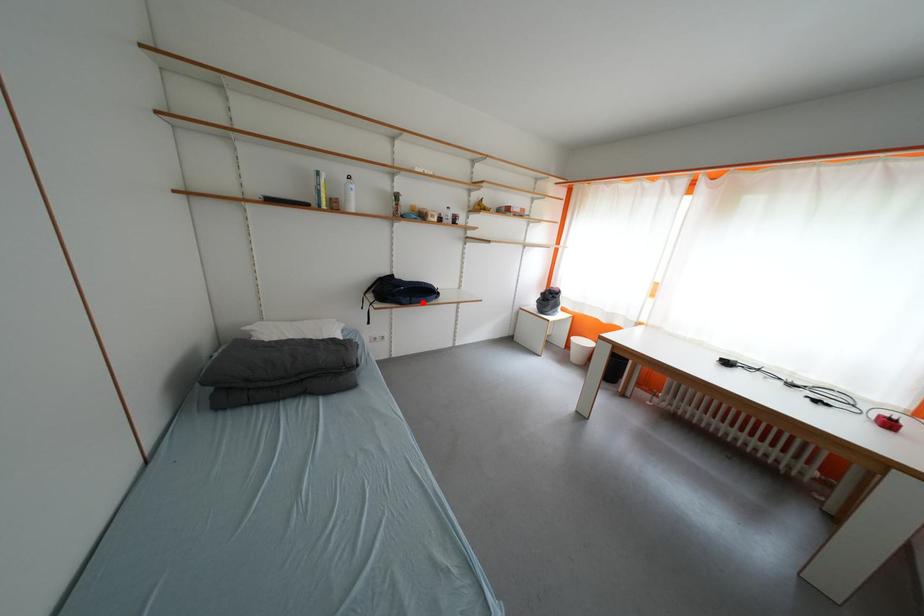
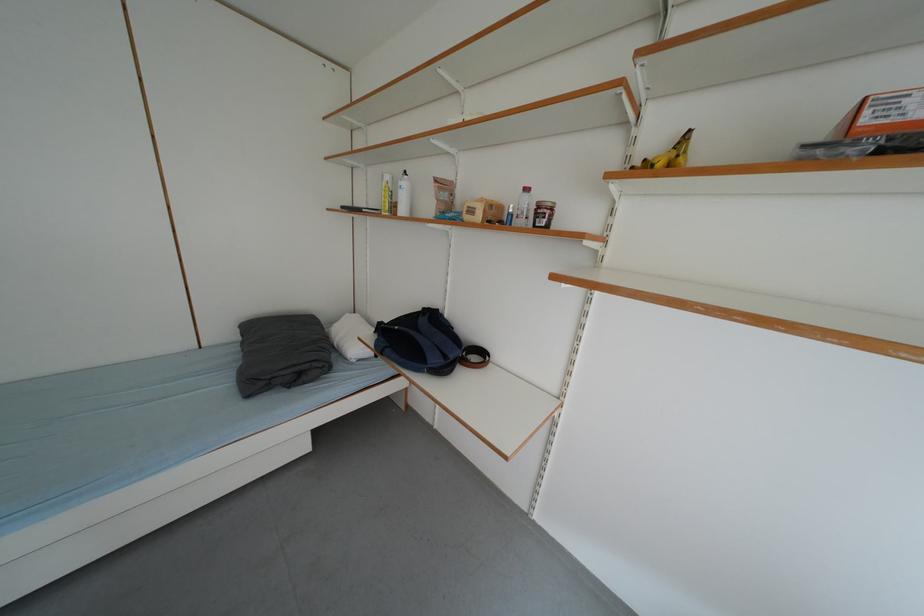
Question: I am providing you with two images of the same scene from different viewpoints. A red point is shown in image1. For the corresponding object point in image2, is it positioned nearer or farther from the camera?

Choices:
 (A) Nearer
 (B) Farther

Answer: (B)